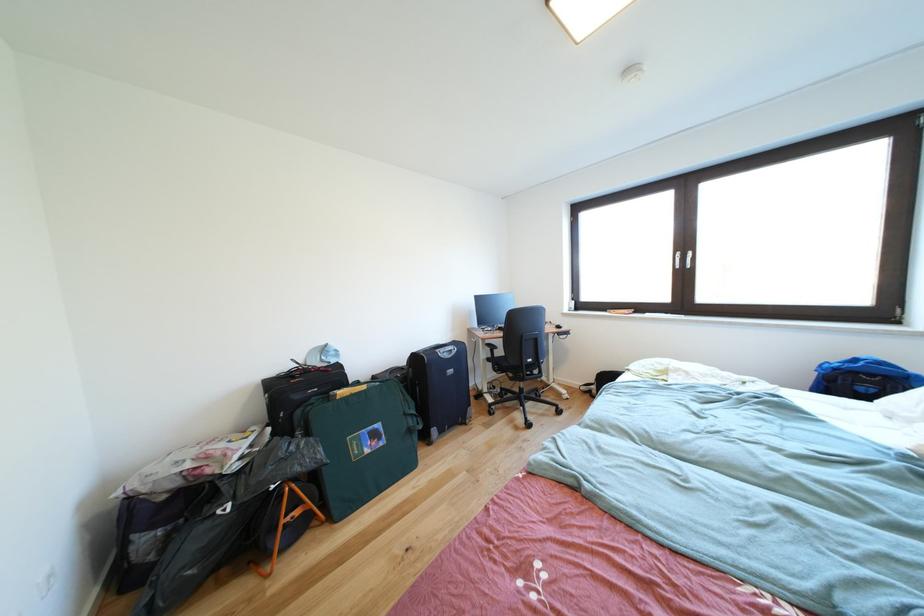
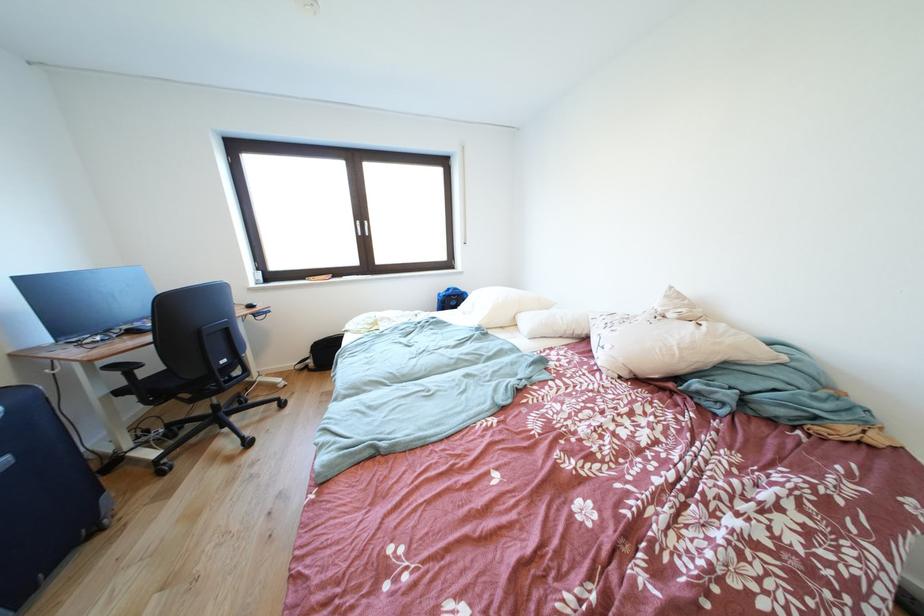
In the second image, find the point that corresponds to point (496, 350) in the first image.

(120, 371)